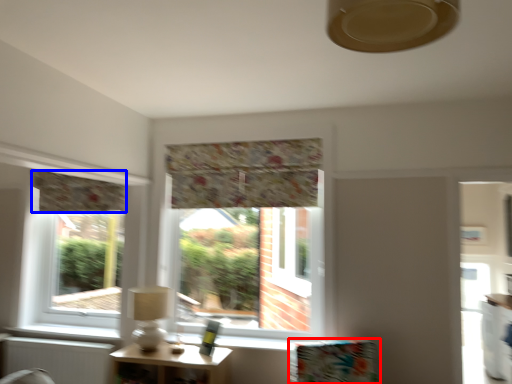
Question: Among these objects, which one is nearest to the camera, furniture (highlighted by a red box) or curtain (highlighted by a blue box)?

Choices:
 (A) furniture
 (B) curtain

Answer: (A)